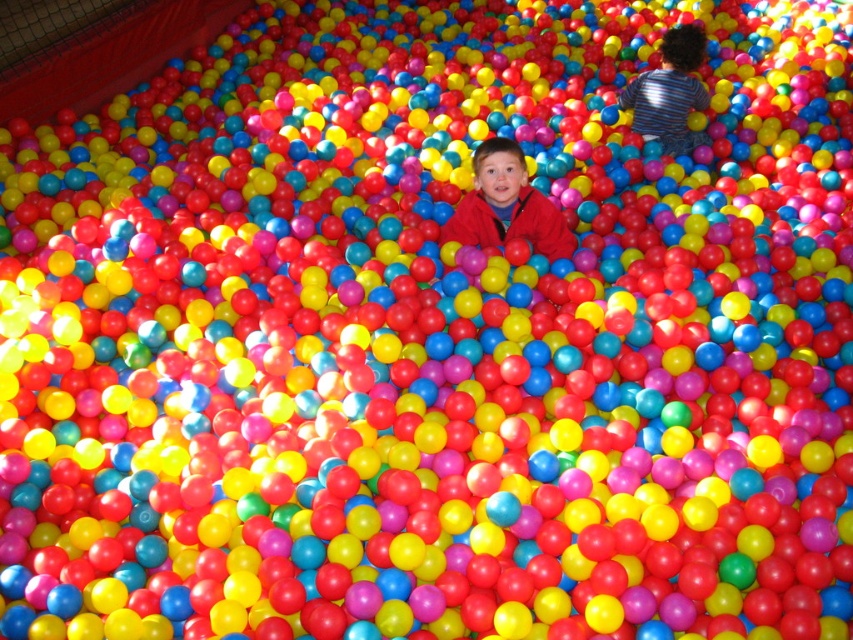
Question: Is matte red jacket at center wider than striped cotton shirt at center?

Choices:
 (A) no
 (B) yes

Answer: (B)

Question: Is matte red jacket at center positioned at the back of striped cotton shirt at center?

Choices:
 (A) yes
 (B) no

Answer: (B)

Question: Which object appears closest to the camera in this image?

Choices:
 (A) striped cotton shirt at center
 (B) matte red jacket at center

Answer: (B)

Question: Observing the image, what is the correct spatial positioning of matte red jacket at center in reference to striped cotton shirt at center?

Choices:
 (A) below
 (B) above

Answer: (A)